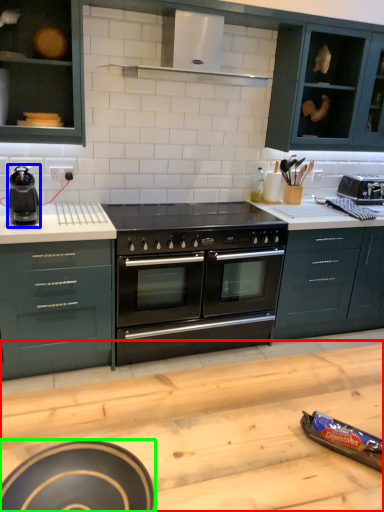
Question: Which is farther away from counter top (highlighted by a red box)? kitchen appliance (highlighted by a blue box) or appliance (highlighted by a green box)?

Choices:
 (A) kitchen appliance
 (B) appliance

Answer: (A)